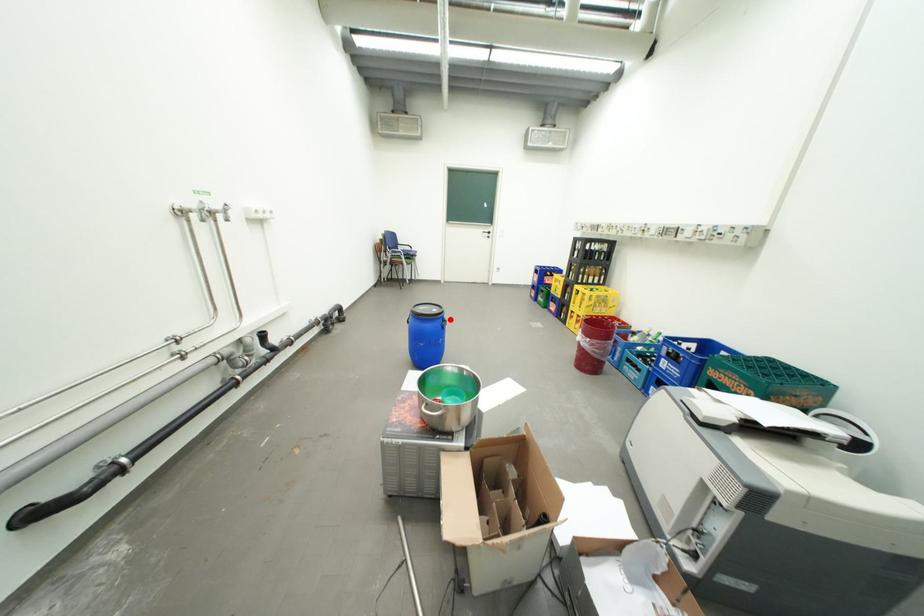
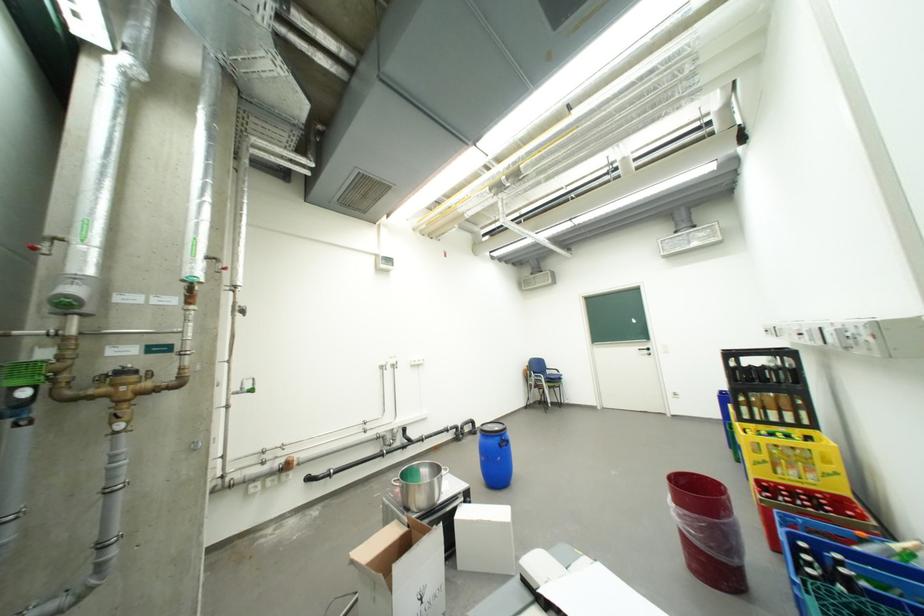
The point at the highlighted location is marked in the first image. Where is the corresponding point in the second image?

(507, 438)